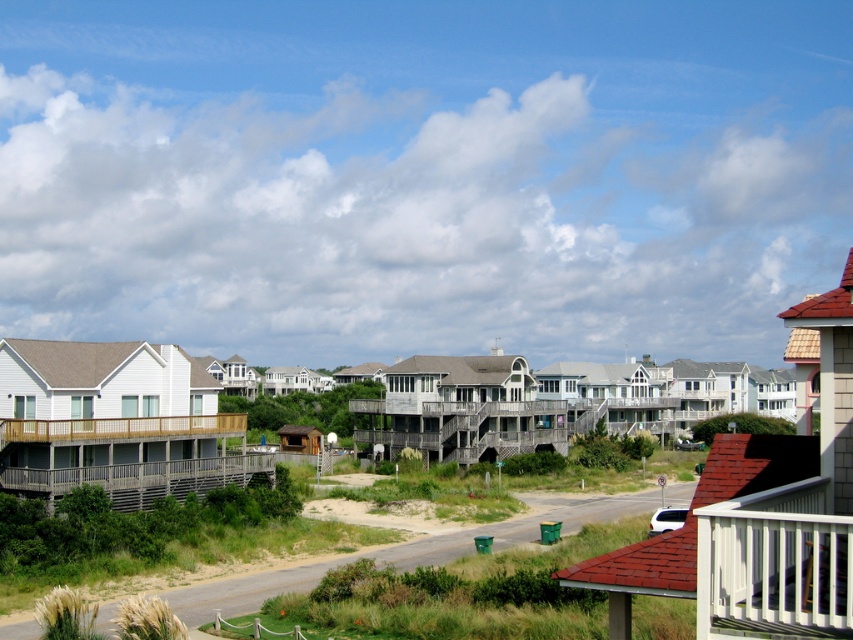
Question: Among these points, which one is farthest from the camera?

Choices:
 (A) (428, 557)
 (B) (515, 422)

Answer: (B)

Question: Is wooden deck at left wider than wooden deck at center?

Choices:
 (A) yes
 (B) no

Answer: (B)

Question: Which of the following is the farthest from the observer?

Choices:
 (A) wooden deck at center
 (B) wooden deck at left

Answer: (A)

Question: Which point is farther to the camera?

Choices:
 (A) wooden deck at center
 (B) green sand at lower left
 (C) wooden deck at left

Answer: (A)

Question: Does wooden deck at left appear over green sand at lower left?

Choices:
 (A) yes
 (B) no

Answer: (A)

Question: Observing the image, what is the correct spatial positioning of wooden deck at left in reference to green sand at lower left?

Choices:
 (A) left
 (B) right

Answer: (A)